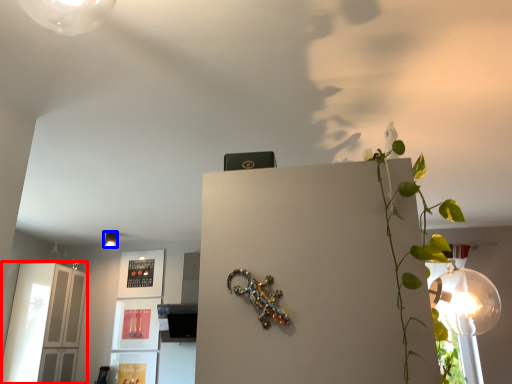
Question: Which object is further to the camera taking this photo, glass door (highlighted by a red box) or lamp (highlighted by a blue box)?

Choices:
 (A) glass door
 (B) lamp

Answer: (B)